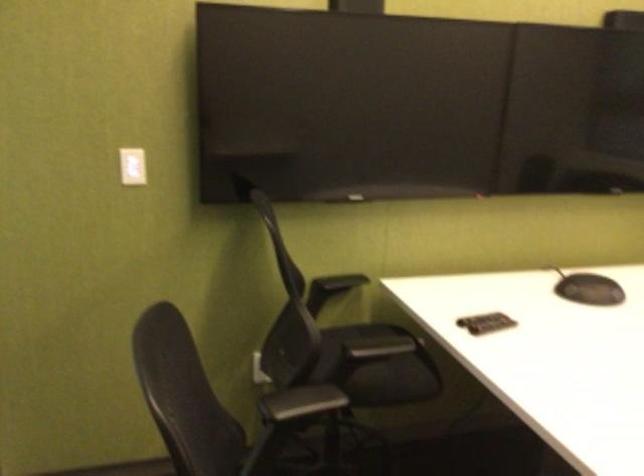
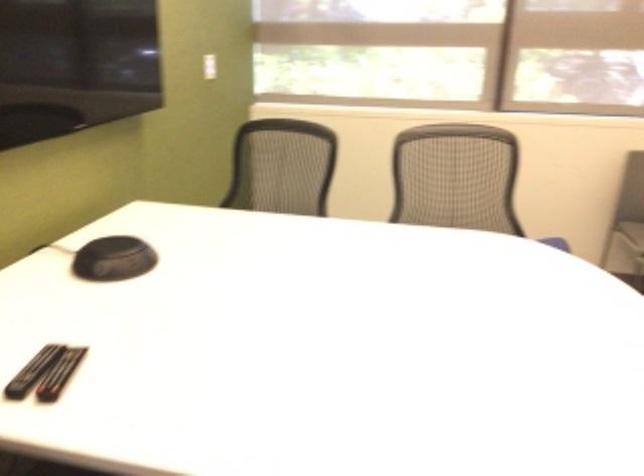
In the second image, find the point that corresponds to point 489,326 in the first image.

(59, 374)